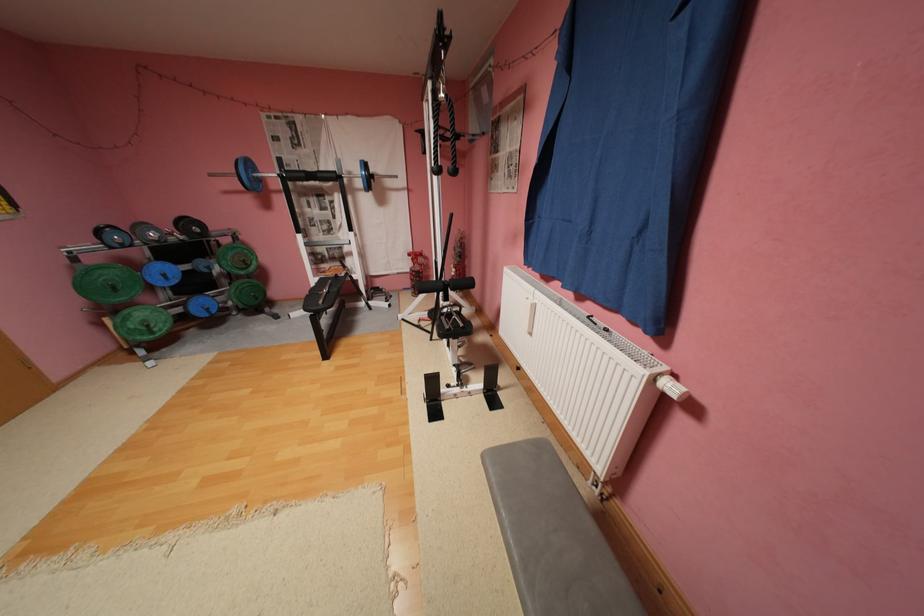
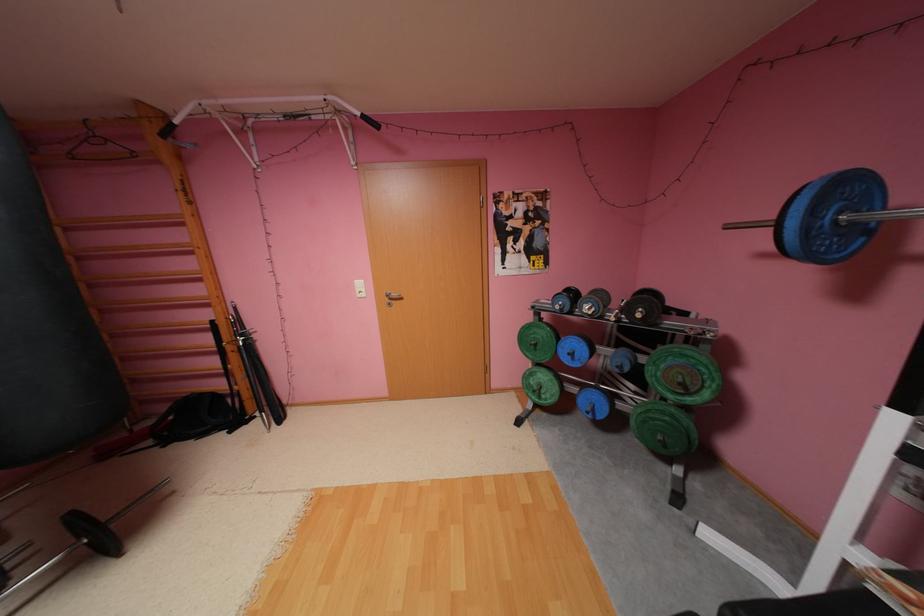
Locate, in the second image, the point that corresponds to the point at 258,177 in the first image.

(816, 229)